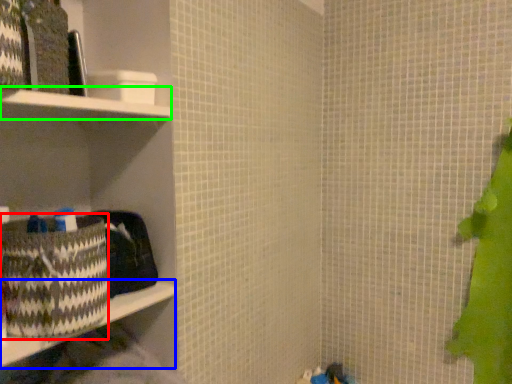
Question: Estimate the real-world distances between objects in this image. Which object is closer to waste (highlighted by a red box), ledge (highlighted by a blue box) or cabinet (highlighted by a green box)?

Choices:
 (A) ledge
 (B) cabinet

Answer: (A)